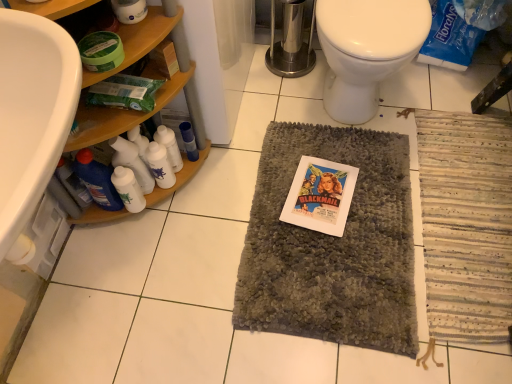
Locate an element on the screen. This screenshot has width=512, height=384. vacant point above matte paper comic book at center (from a real-world perspective) is located at coordinates (324, 195).